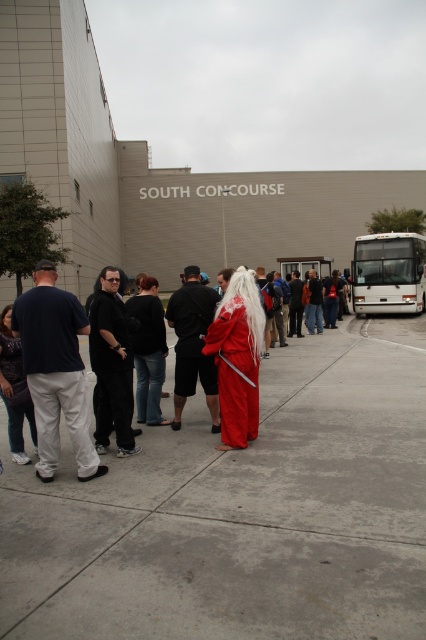
Between dark blue t-shirt at center and dark blue jeans at center, which one has less height?

Standing shorter between the two is dark blue t-shirt at center.

From the picture: Who is positioned more to the right, dark blue t-shirt at center or dark blue jeans at center?

From the viewer's perspective, dark blue jeans at center appears more on the right side.

What do you see at coordinates (55, 371) in the screenshot?
I see `dark blue t-shirt at center` at bounding box center [55, 371].

Image resolution: width=426 pixels, height=640 pixels. In order to click on dark blue t-shirt at center in this screenshot , I will do `click(55, 371)`.

Which of these two, red satin dress at center or matte black robe at center, stands shorter?

With less height is matte black robe at center.

Who is lower down, red satin dress at center or matte black robe at center?

red satin dress at center is below.

Identify the location of red satin dress at center. (170, 461).

Is white matte bus at right shorter than black matte robe at center?

No, white matte bus at right is not shorter than black matte robe at center.

Which is behind, point (402, 288) or point (94, 320)?

The point (402, 288) is behind.

Find the location of a particular element. This screenshot has height=640, width=426. white matte bus at right is located at coordinates (388, 273).